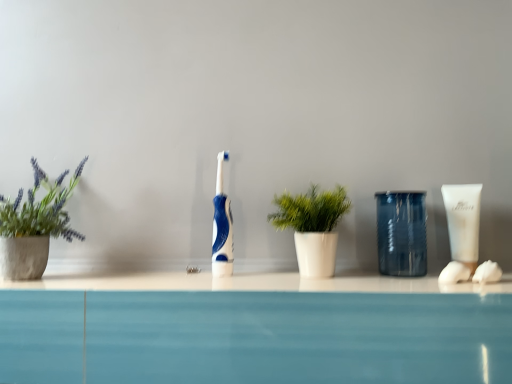
Question: Are transparent textured glass at center right and white cotton ball at right far apart?

Choices:
 (A) no
 (B) yes

Answer: (A)

Question: Is transparent textured glass at center right further to the viewer compared to white cotton ball at right?

Choices:
 (A) yes
 (B) no

Answer: (A)

Question: Can you confirm if transparent textured glass at center right is wider than white cotton ball at right?

Choices:
 (A) no
 (B) yes

Answer: (B)

Question: Does transparent textured glass at center right have a lesser height compared to white cotton ball at right?

Choices:
 (A) yes
 (B) no

Answer: (B)

Question: From a real-world perspective, does transparent textured glass at center right stand above white cotton ball at right?

Choices:
 (A) yes
 (B) no

Answer: (A)

Question: From the image's perspective, is transparent textured glass at center right located above white cotton ball at right?

Choices:
 (A) no
 (B) yes

Answer: (B)

Question: Is the position of blue glossy toothbrush at center less distant than that of green matte plant at left, the 2th houseplant viewed from the right?

Choices:
 (A) yes
 (B) no

Answer: (B)

Question: From a real-world perspective, is blue glossy toothbrush at center physically above green matte plant at left, the 2th houseplant viewed from the right?

Choices:
 (A) no
 (B) yes

Answer: (A)

Question: Does blue glossy toothbrush at center have a greater height compared to green matte plant at left, which is the 1th houseplant from left to right?

Choices:
 (A) yes
 (B) no

Answer: (B)

Question: Does blue glossy toothbrush at center have a larger size compared to green matte plant at left, the 2th houseplant viewed from the right?

Choices:
 (A) yes
 (B) no

Answer: (B)

Question: Are blue glossy toothbrush at center and green matte plant at left, the 2th houseplant viewed from the right, located far from each other?

Choices:
 (A) no
 (B) yes

Answer: (A)

Question: Is the surface of blue glossy toothbrush at center in direct contact with green matte plant at left, which is the 1th houseplant from left to right?

Choices:
 (A) no
 (B) yes

Answer: (A)

Question: Is green matte plant at left, which is the 1th houseplant from left to right, not within white cotton ball at right?

Choices:
 (A) yes
 (B) no

Answer: (A)